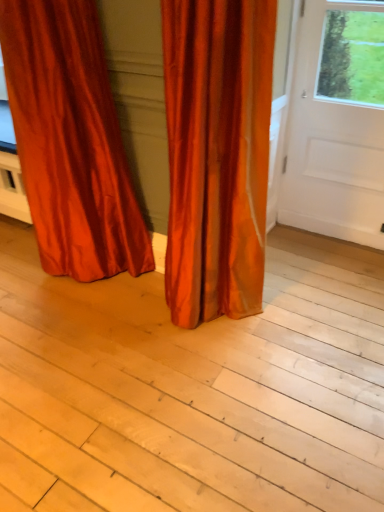
Question: From a real-world perspective, is satin orange curtain at lower left, which ranks as the 1th curtain in left-to-right order, physically below light wood plank at center?

Choices:
 (A) no
 (B) yes

Answer: (A)

Question: Does satin orange curtain at lower left, which appears as the 2th curtain when viewed from the right, appear on the left side of light wood plank at center?

Choices:
 (A) no
 (B) yes

Answer: (B)

Question: Is satin orange curtain at lower left, which ranks as the 1th curtain in left-to-right order, wider than light wood plank at center?

Choices:
 (A) no
 (B) yes

Answer: (A)

Question: Can you confirm if satin orange curtain at lower left, which appears as the 2th curtain when viewed from the right, is thinner than light wood plank at center?

Choices:
 (A) no
 (B) yes

Answer: (B)

Question: From the image's perspective, is satin orange curtain at lower left, which appears as the 2th curtain when viewed from the right, located above light wood plank at center?

Choices:
 (A) no
 (B) yes

Answer: (B)

Question: Is satin orange curtain at center, which is the 2th curtain from left to right, situated inside white smooth door at right or outside?

Choices:
 (A) outside
 (B) inside

Answer: (A)

Question: Is satin orange curtain at center, the first curtain viewed from the right, wider or thinner than white smooth door at right?

Choices:
 (A) thin
 (B) wide

Answer: (B)

Question: Does point (205, 125) appear closer or farther from the camera than point (344, 34)?

Choices:
 (A) closer
 (B) farther

Answer: (A)

Question: From the image's perspective, is satin orange curtain at center, which is the 2th curtain from left to right, above or below white smooth door at right?

Choices:
 (A) below
 (B) above

Answer: (A)

Question: From their relative heights in the image, would you say white smooth door at right is taller or shorter than satin orange curtain at lower left, which appears as the 2th curtain when viewed from the right?

Choices:
 (A) tall
 (B) short

Answer: (B)

Question: From a real-world perspective, is white smooth door at right physically located above or below satin orange curtain at lower left, which appears as the 2th curtain when viewed from the right?

Choices:
 (A) above
 (B) below

Answer: (B)

Question: Is white smooth door at right in front of or behind satin orange curtain at lower left, which ranks as the 1th curtain in left-to-right order, in the image?

Choices:
 (A) behind
 (B) front

Answer: (A)

Question: Considering the relative positions of white smooth door at right and satin orange curtain at lower left, which ranks as the 1th curtain in left-to-right order, in the image provided, is white smooth door at right to the left or to the right of satin orange curtain at lower left, which ranks as the 1th curtain in left-to-right order,?

Choices:
 (A) left
 (B) right

Answer: (B)

Question: Considering the positions of light wood plank at center and satin orange curtain at center, which is the 2th curtain from left to right, in the image, is light wood plank at center taller or shorter than satin orange curtain at center, which is the 2th curtain from left to right,?

Choices:
 (A) short
 (B) tall

Answer: (A)

Question: Is light wood plank at center spatially inside satin orange curtain at center, the first curtain viewed from the right, or outside of it?

Choices:
 (A) inside
 (B) outside

Answer: (B)